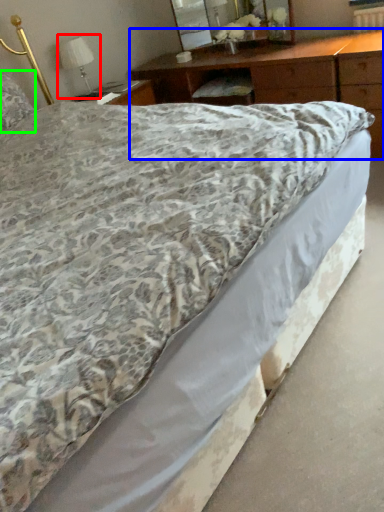
Question: Considering the real-world distances, which object is farthest from table lamp (highlighted by a red box)? nightstand (highlighted by a blue box) or pillow (highlighted by a green box)?

Choices:
 (A) nightstand
 (B) pillow

Answer: (A)